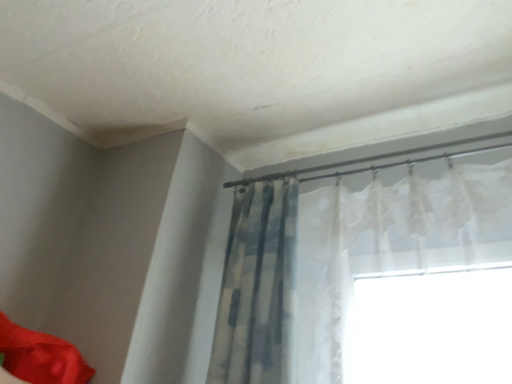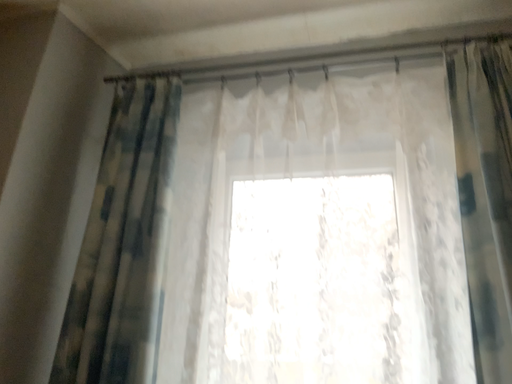
Question: How did the camera likely rotate when shooting the video?

Choices:
 (A) rotated downward
 (B) rotated upward

Answer: (A)